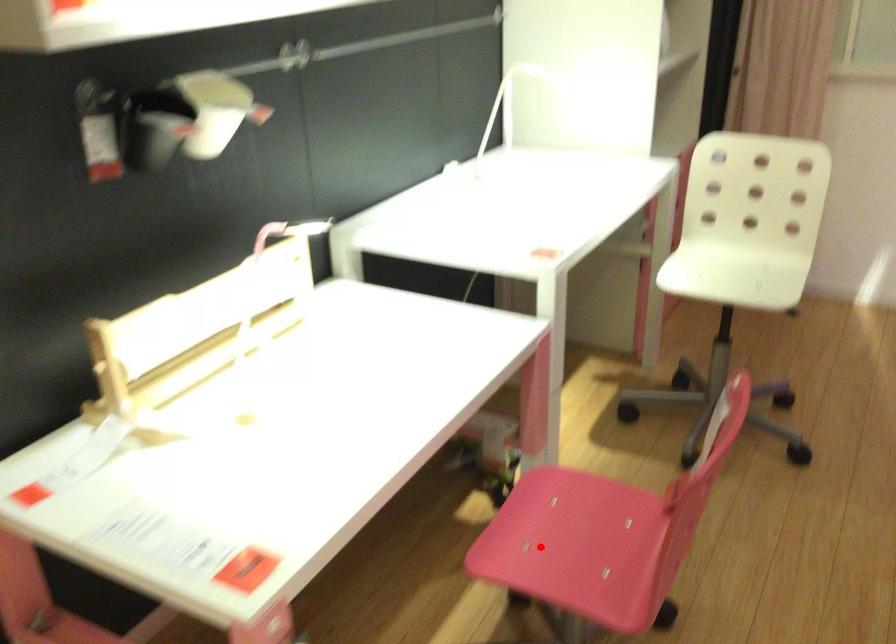
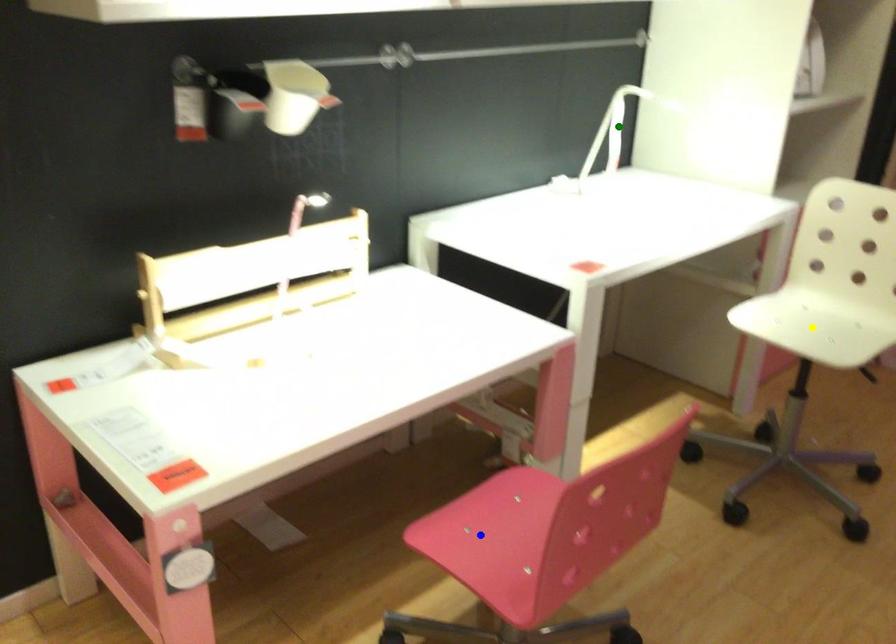
Question: I am providing you with two images of the same scene from different viewpoints. A red point is marked on the first image. You are given multiple points on the second image. Which spot in image 2 lines up with the point in image 1?

Choices:
 (A) green point
 (B) blue point
 (C) yellow point

Answer: (B)